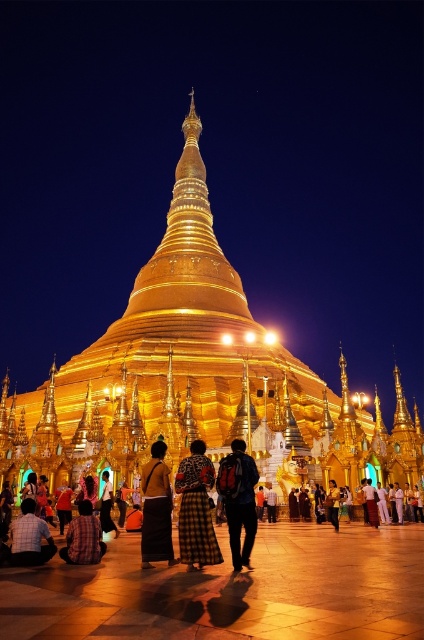
You are a visitor standing in front of the temple complex. You see the golden polished pagoda at center and the golden silk skirt at center. Which one appears taller from your perspective?

The golden polished pagoda at center is much taller than the golden silk skirt at center, so it appears taller from your perspective.

You are standing in front of the temple complex and want to take a photo of the golden polished pagoda at center. If your camera can focus on objects up to 60 meters away, will it be able to capture the pagoda clearly?

The golden polished pagoda at center is 57.81 meters away from the camera. Since the camera can focus up to 60 meters, it will be able to capture the pagoda clearly.